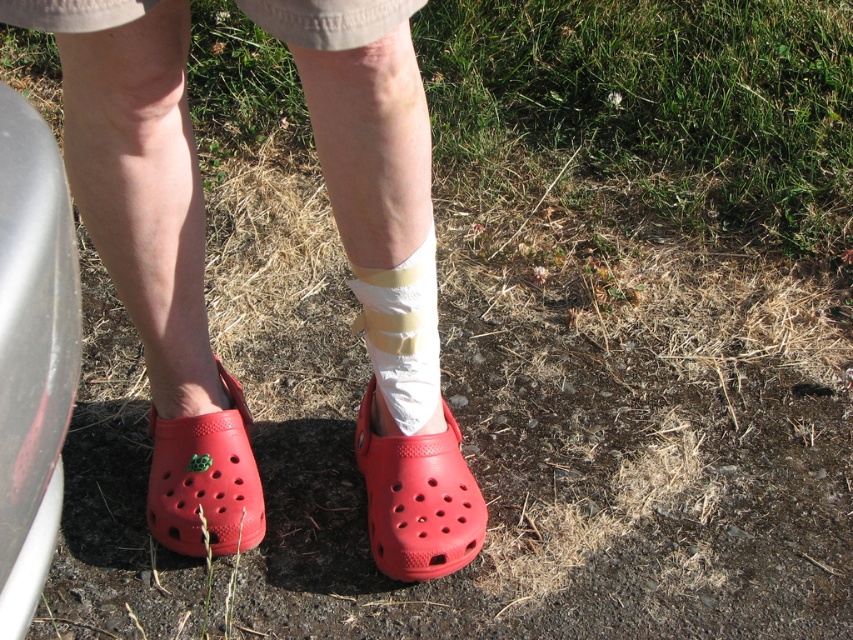
You are a delivery robot with a width of 12 inches. You need to navigate between the matte rubber clog at lower left and the rubber croc at center. Can you fit through the space between them?

The matte rubber clog at lower left and the rubber croc at center are 6.71 inches apart. Since the distance between them is less than your width of 12 inches, you cannot fit through the space between them.